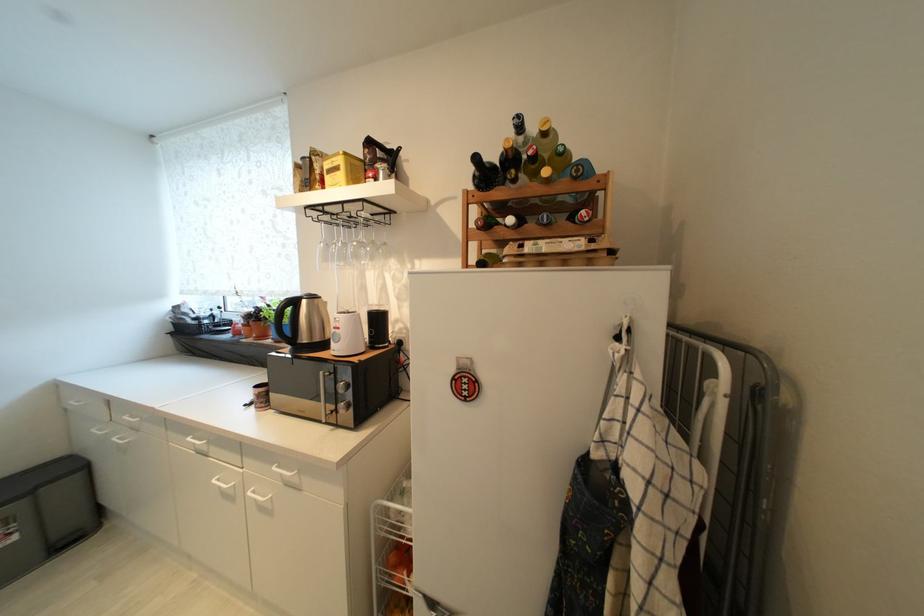
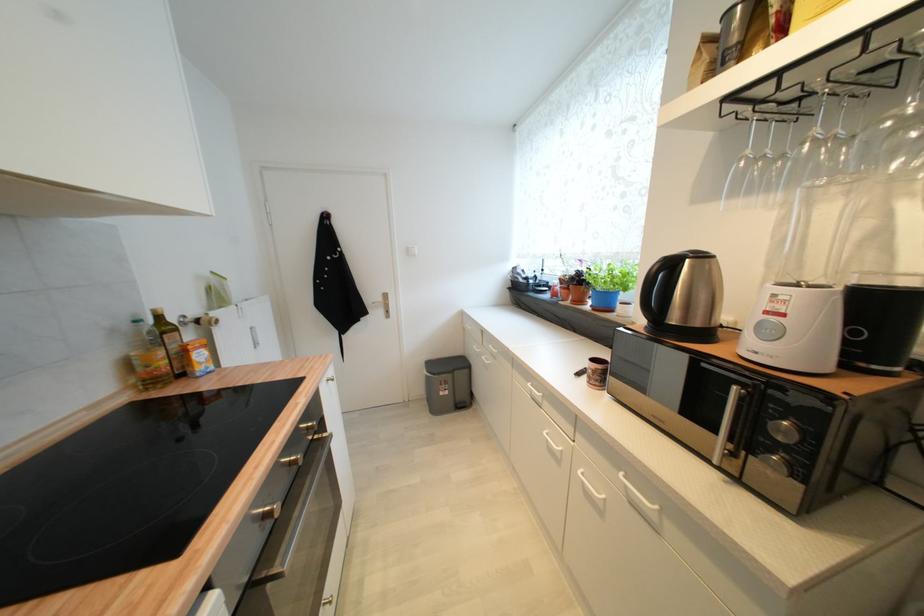
Question: The camera is either moving clockwise (left) or counter-clockwise (right) around the object. The first image is from the beginning of the video and the second image is from the end. Is the camera moving left or right when shooting the video?

Choices:
 (A) Left
 (B) Right

Answer: (B)